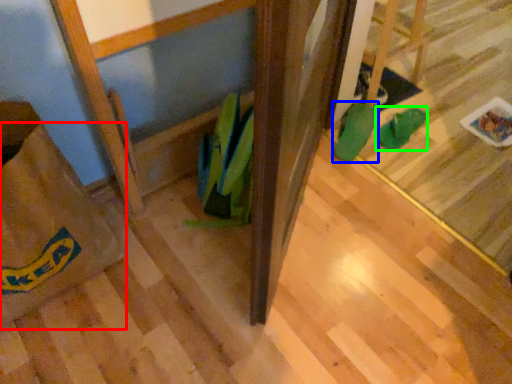
Question: Based on their relative distances, which object is farther from grocery bag (highlighted by a red box)? Choose from footwear (highlighted by a blue box) and footwear (highlighted by a green box).

Choices:
 (A) footwear
 (B) footwear

Answer: (B)